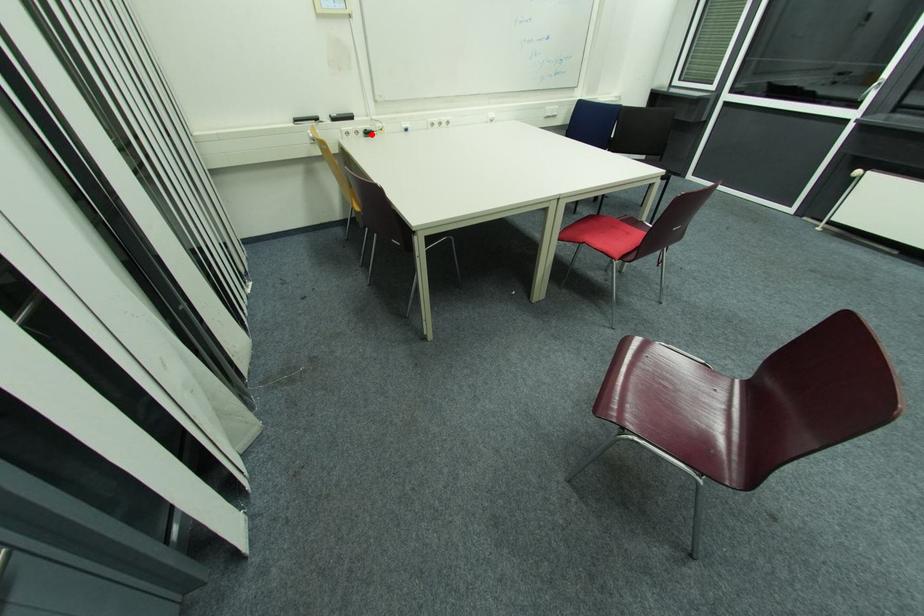
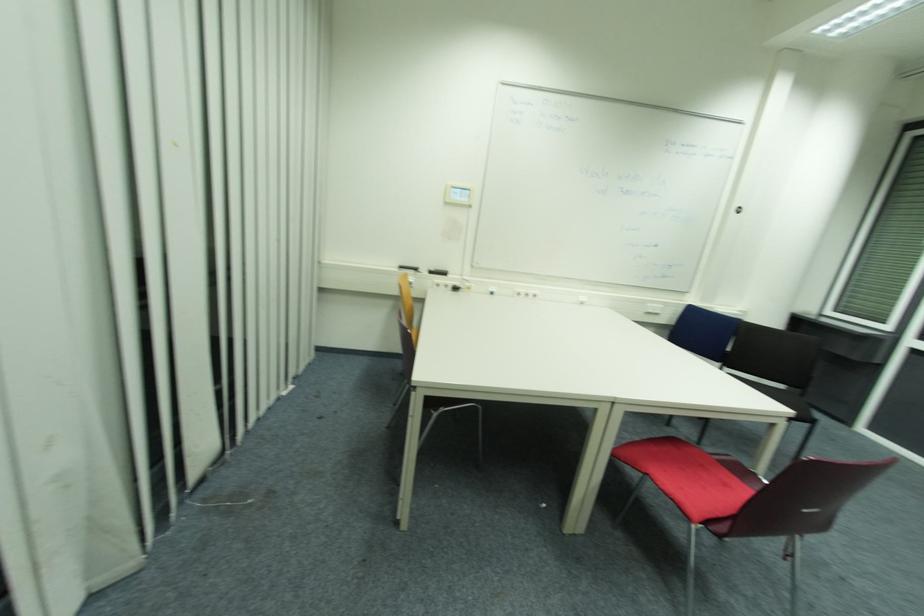
Find the pixel in the second image that matches the highlighted location in the first image.

(458, 290)